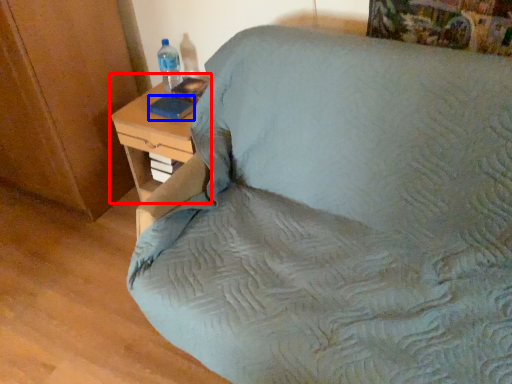
Question: Which point is closer to the camera, nightstand (highlighted by a red box) or pad (highlighted by a blue box)?

Choices:
 (A) nightstand
 (B) pad

Answer: (A)